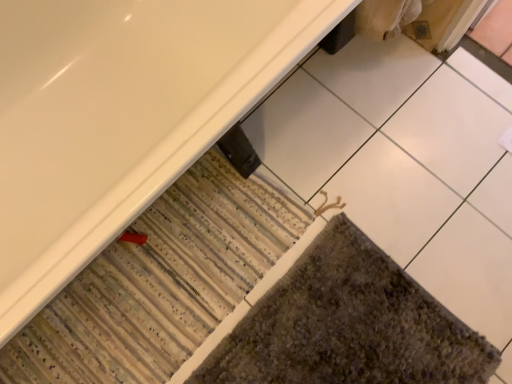
What do you see at coordinates (160, 283) in the screenshot?
I see `striped carpet at lower left, which appears as the 1th bath mat when viewed from the left` at bounding box center [160, 283].

This screenshot has height=384, width=512. I want to click on white glossy bathtub at lower left, so click(x=120, y=116).

I want to click on textured gray bath mat at lower right, arranged as the 2th bath mat when viewed from the left, so (348, 325).

Where is `striped carpet at lower left, the second bath mat from the right`? The height and width of the screenshot is (384, 512). striped carpet at lower left, the second bath mat from the right is located at coordinates (160, 283).

Is textured gray bath mat at lower right, arranged as the 2th bath mat when viewed from the left, next to striped carpet at lower left, which appears as the 1th bath mat when viewed from the left, and touching it?

There is a gap between textured gray bath mat at lower right, arranged as the 2th bath mat when viewed from the left, and striped carpet at lower left, which appears as the 1th bath mat when viewed from the left.

Considering the sizes of objects textured gray bath mat at lower right, arranged as the 2th bath mat when viewed from the left, and striped carpet at lower left, the second bath mat from the right, in the image provided, who is smaller, textured gray bath mat at lower right, arranged as the 2th bath mat when viewed from the left, or striped carpet at lower left, the second bath mat from the right,?

textured gray bath mat at lower right, arranged as the 2th bath mat when viewed from the left, is smaller.

Is textured gray bath mat at lower right, marked as the 1th bath mat in a right-to-left arrangement, further to the viewer compared to striped carpet at lower left, which appears as the 1th bath mat when viewed from the left?

No, textured gray bath mat at lower right, marked as the 1th bath mat in a right-to-left arrangement, is closer to the viewer.

Is textured gray bath mat at lower right, arranged as the 2th bath mat when viewed from the left, taller than striped carpet at lower left, which appears as the 1th bath mat when viewed from the left?

No.

Is the position of striped carpet at lower left, which appears as the 1th bath mat when viewed from the left, more distant than that of textured gray bath mat at lower right, marked as the 1th bath mat in a right-to-left arrangement?

Yes.

Between striped carpet at lower left, which appears as the 1th bath mat when viewed from the left, and textured gray bath mat at lower right, arranged as the 2th bath mat when viewed from the left, which one has larger size?

striped carpet at lower left, which appears as the 1th bath mat when viewed from the left.

Does striped carpet at lower left, the second bath mat from the right, appear on the right side of textured gray bath mat at lower right, arranged as the 2th bath mat when viewed from the left?

In fact, striped carpet at lower left, the second bath mat from the right, is to the left of textured gray bath mat at lower right, arranged as the 2th bath mat when viewed from the left.

Is point (217, 254) closer to camera compared to point (376, 248)?

No, it is behind (376, 248).

In the image, is white glossy bathtub at lower left on the left side or the right side of striped carpet at lower left, the second bath mat from the right?

Clearly, white glossy bathtub at lower left is on the left of striped carpet at lower left, the second bath mat from the right, in the image.

Looking at their sizes, would you say white glossy bathtub at lower left is wider or thinner than striped carpet at lower left, which appears as the 1th bath mat when viewed from the left?

Considering their sizes, white glossy bathtub at lower left looks broader than striped carpet at lower left, which appears as the 1th bath mat when viewed from the left.

How many degrees apart are the facing directions of white glossy bathtub at lower left and striped carpet at lower left, the second bath mat from the right?

There is a 90-degree angle between the facing directions of white glossy bathtub at lower left and striped carpet at lower left, the second bath mat from the right.

Find the location of `bath mat that is the 1st object directly below the white glossy bathtub at lower left (from a real-world perspective)`. bath mat that is the 1st object directly below the white glossy bathtub at lower left (from a real-world perspective) is located at coordinates (348, 325).

Is white glossy bathtub at lower left at the back of textured gray bath mat at lower right, marked as the 1th bath mat in a right-to-left arrangement?

No, textured gray bath mat at lower right, marked as the 1th bath mat in a right-to-left arrangement,'s orientation is not away from white glossy bathtub at lower left.

Is there a large distance between textured gray bath mat at lower right, arranged as the 2th bath mat when viewed from the left, and white glossy bathtub at lower left?

No, textured gray bath mat at lower right, arranged as the 2th bath mat when viewed from the left, is not far from white glossy bathtub at lower left.

From a real-world perspective, does textured gray bath mat at lower right, marked as the 1th bath mat in a right-to-left arrangement, stand above white glossy bathtub at lower left?

No, from a real-world perspective, textured gray bath mat at lower right, marked as the 1th bath mat in a right-to-left arrangement, is not over white glossy bathtub at lower left

Could you tell me if striped carpet at lower left, which appears as the 1th bath mat when viewed from the left, is facing white glossy bathtub at lower left?

Yes, striped carpet at lower left, which appears as the 1th bath mat when viewed from the left, is turned towards white glossy bathtub at lower left.

Can white glossy bathtub at lower left be found inside striped carpet at lower left, the second bath mat from the right?

No, white glossy bathtub at lower left is not inside striped carpet at lower left, the second bath mat from the right.

Is striped carpet at lower left, the second bath mat from the right, next to white glossy bathtub at lower left and touching it?

No, striped carpet at lower left, the second bath mat from the right, is not making contact with white glossy bathtub at lower left.

Considering the sizes of objects striped carpet at lower left, the second bath mat from the right, and white glossy bathtub at lower left in the image provided, who is thinner, striped carpet at lower left, the second bath mat from the right, or white glossy bathtub at lower left?

Thinner between the two is striped carpet at lower left, the second bath mat from the right.

Would you say white glossy bathtub at lower left is outside textured gray bath mat at lower right, marked as the 1th bath mat in a right-to-left arrangement?

Yes.

From a real-world perspective, who is located higher, white glossy bathtub at lower left or textured gray bath mat at lower right, marked as the 1th bath mat in a right-to-left arrangement?

white glossy bathtub at lower left.

Is white glossy bathtub at lower left facing away from textured gray bath mat at lower right, arranged as the 2th bath mat when viewed from the left?

No, textured gray bath mat at lower right, arranged as the 2th bath mat when viewed from the left, is not at the back of white glossy bathtub at lower left.

Between point (153, 167) and point (423, 296), which one is positioned behind?

The point (423, 296) is more distant.

The image size is (512, 384). Identify the location of bath mat on the right of striped carpet at lower left, the second bath mat from the right. (348, 325).

Locate an element on the screen. The image size is (512, 384). bath mat below the striped carpet at lower left, which appears as the 1th bath mat when viewed from the left (from the image's perspective) is located at coordinates pos(348,325).

When comparing their distances from textured gray bath mat at lower right, marked as the 1th bath mat in a right-to-left arrangement, does white glossy bathtub at lower left or striped carpet at lower left, which appears as the 1th bath mat when viewed from the left, seem further?

white glossy bathtub at lower left lies further to textured gray bath mat at lower right, marked as the 1th bath mat in a right-to-left arrangement, than the other object.

Looking at this image, which object lies further to the anchor point textured gray bath mat at lower right, arranged as the 2th bath mat when viewed from the left, striped carpet at lower left, which appears as the 1th bath mat when viewed from the left, or white glossy bathtub at lower left?

The object further to textured gray bath mat at lower right, arranged as the 2th bath mat when viewed from the left, is white glossy bathtub at lower left.

Which object lies nearer to the anchor point striped carpet at lower left, which appears as the 1th bath mat when viewed from the left, white glossy bathtub at lower left or textured gray bath mat at lower right, arranged as the 2th bath mat when viewed from the left?

Based on the image, textured gray bath mat at lower right, arranged as the 2th bath mat when viewed from the left, appears to be nearer to striped carpet at lower left, which appears as the 1th bath mat when viewed from the left.

When comparing their distances from white glossy bathtub at lower left, does textured gray bath mat at lower right, arranged as the 2th bath mat when viewed from the left, or striped carpet at lower left, the second bath mat from the right, seem closer?

Among the two, striped carpet at lower left, the second bath mat from the right, is located nearer to white glossy bathtub at lower left.

When comparing their distances from white glossy bathtub at lower left, does striped carpet at lower left, which appears as the 1th bath mat when viewed from the left, or textured gray bath mat at lower right, marked as the 1th bath mat in a right-to-left arrangement, seem further?

textured gray bath mat at lower right, marked as the 1th bath mat in a right-to-left arrangement, is further to white glossy bathtub at lower left.

When comparing their distances from striped carpet at lower left, which appears as the 1th bath mat when viewed from the left, does textured gray bath mat at lower right, marked as the 1th bath mat in a right-to-left arrangement, or white glossy bathtub at lower left seem closer?

textured gray bath mat at lower right, marked as the 1th bath mat in a right-to-left arrangement, lies closer to striped carpet at lower left, which appears as the 1th bath mat when viewed from the left, than the other object.

Where is `bath mat situated between white glossy bathtub at lower left and textured gray bath mat at lower right, arranged as the 2th bath mat when viewed from the left, from left to right`? Image resolution: width=512 pixels, height=384 pixels. bath mat situated between white glossy bathtub at lower left and textured gray bath mat at lower right, arranged as the 2th bath mat when viewed from the left, from left to right is located at coordinates (160, 283).